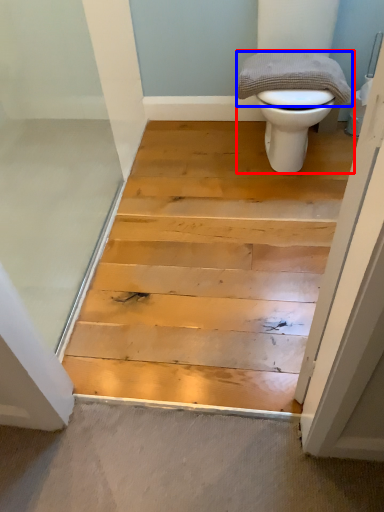
Question: Among these objects, which one is nearest to the camera, toilet (highlighted by a red box) or material (highlighted by a blue box)?

Choices:
 (A) toilet
 (B) material

Answer: (A)